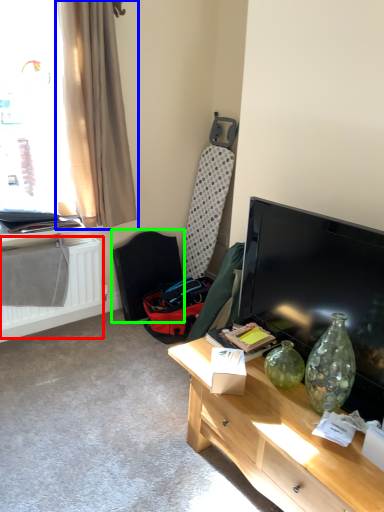
Question: Which is farther away from radiator (highlighted by a red box)? curtain (highlighted by a blue box) or swivel chair (highlighted by a green box)?

Choices:
 (A) curtain
 (B) swivel chair

Answer: (A)